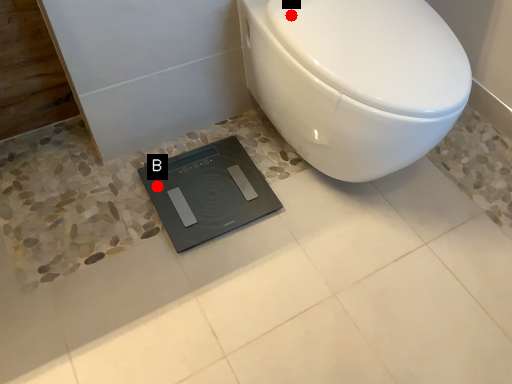
Question: Two points are circled on the image, labeled by A and B beside each circle. Which point is farther to the camera?

Choices:
 (A) A is further
 (B) B is further

Answer: (B)